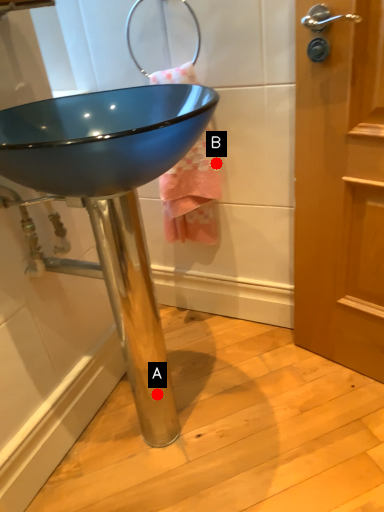
Question: Two points are circled on the image, labeled by A and B beside each circle. Which point is closer to the camera taking this photo?

Choices:
 (A) A is closer
 (B) B is closer

Answer: (B)